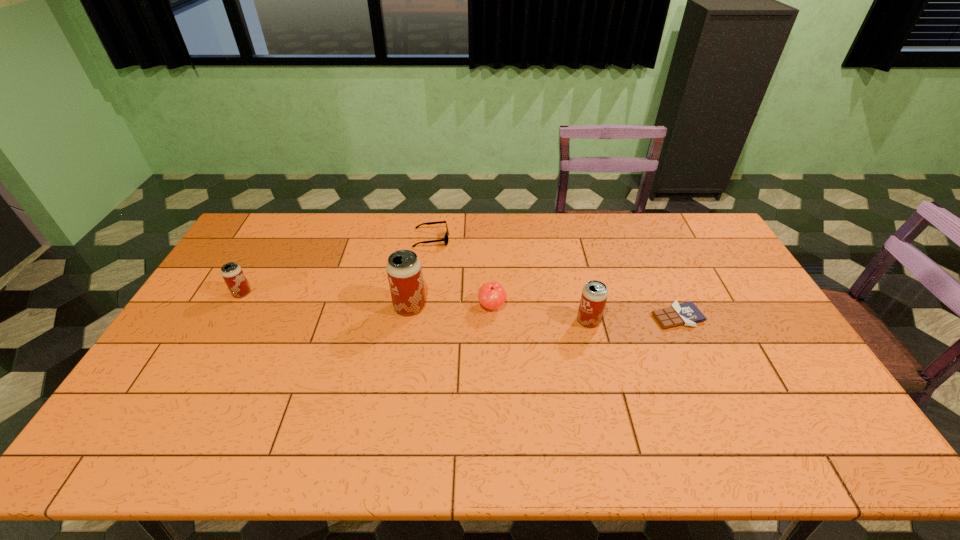
The image size is (960, 540). I want to click on the shortest beer can, so click(x=232, y=273).

Locate an element on the screen. The height and width of the screenshot is (540, 960). the leftmost beer can is located at coordinates (232, 273).

Where is `the tallest object`? The height and width of the screenshot is (540, 960). the tallest object is located at coordinates (404, 270).

Find the location of `the tallest beer can`. the tallest beer can is located at coordinates (404, 270).

Locate an element on the screen. This screenshot has height=540, width=960. the second tallest beer can is located at coordinates (594, 295).

Identify the location of the rightmost beer can. The height and width of the screenshot is (540, 960). (594, 295).

This screenshot has height=540, width=960. I want to click on the farthest object, so click(x=445, y=239).

Where is `the second shortest object`? the second shortest object is located at coordinates (445, 239).

Where is `the shortest object`? This screenshot has height=540, width=960. the shortest object is located at coordinates (687, 313).

Where is `the rightmost object`? Image resolution: width=960 pixels, height=540 pixels. the rightmost object is located at coordinates (687, 313).